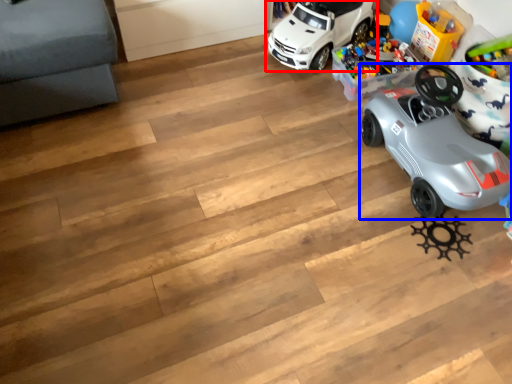
Question: Among these objects, which one is nearest to the camera, car (highlighted by a red box) or car (highlighted by a blue box)?

Choices:
 (A) car
 (B) car

Answer: (B)